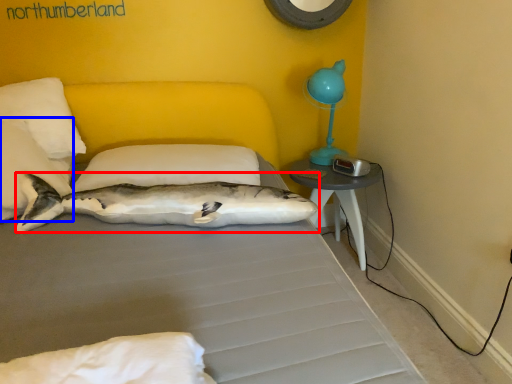
Question: Which object is further to the camera taking this photo, shark (highlighted by a red box) or pillow (highlighted by a blue box)?

Choices:
 (A) shark
 (B) pillow

Answer: (B)